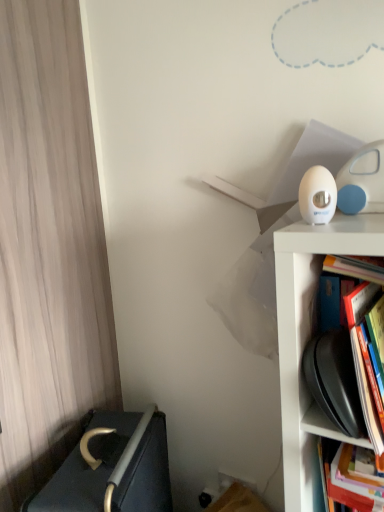
Question: Choose the correct answer: Is hardcover book at right, positioned as the second book in top-to-bottom order, inside wooden curtain at left or outside it?

Choices:
 (A) inside
 (B) outside

Answer: (B)

Question: Looking at the image, does hardcover book at right, arranged as the first book when ordered from the bottom, seem bigger or smaller compared to wooden curtain at left?

Choices:
 (A) big
 (B) small

Answer: (B)

Question: Estimate the real-world distances between objects in this image. Which object is closer to the dark gray fabric bed at lower left?

Choices:
 (A) wooden curtain at left
 (B) hardcover book at right, arranged as the first book when ordered from the bottom
 (C) hardcover book at right, which is the 1th book from top to bottom

Answer: (A)

Question: Considering the real-world distances, which object is farthest from the hardcover book at right, which is the 1th book from top to bottom?

Choices:
 (A) wooden curtain at left
 (B) hardcover book at right, positioned as the second book in top-to-bottom order
 (C) dark gray fabric bed at lower left

Answer: (A)